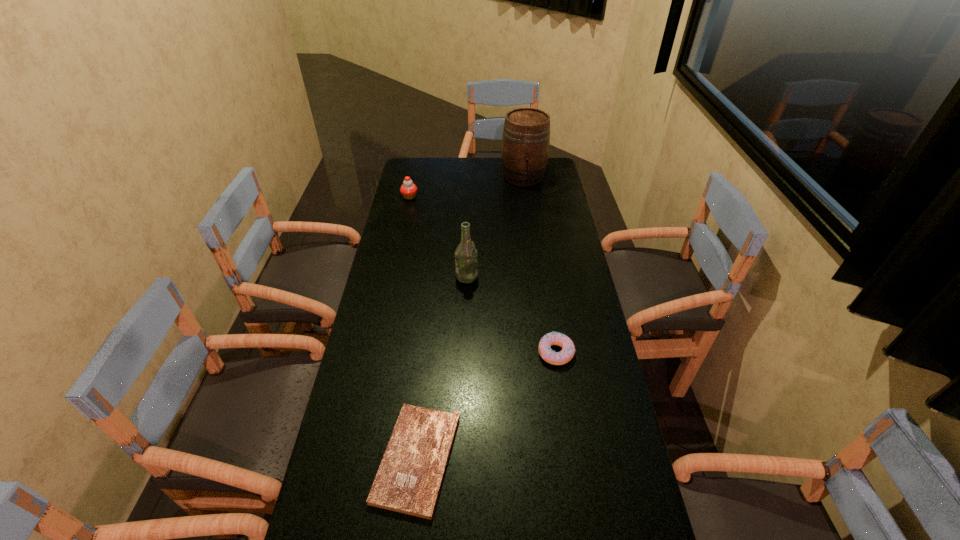
Image resolution: width=960 pixels, height=540 pixels. Identify the location of free space between the tallest object and the doughnut. (540, 265).

This screenshot has width=960, height=540. I want to click on free space between the leftmost object and the doughnut, so click(483, 275).

At what (x,y) coordinates should I click in order to perform the action: click on vacant area that lies between the farthest object and the nearest object. Please return your answer as a coordinate pair (x, y). Looking at the image, I should click on (x=470, y=318).

Locate an element on the screen. The image size is (960, 540). vacant area between the Bible and the third nearest object is located at coordinates (442, 368).

Locate an element on the screen. The width and height of the screenshot is (960, 540). vacant area that lies between the cider and the beer bottle is located at coordinates (495, 226).

Locate which object ranks in proximity to the shortest object. Please provide its 2D coordinates. Your answer should be formatted as a tuple, i.e. [(x, y)], where the tuple contains the x and y coordinates of a point satisfying the conditions above.

[(547, 354)]

Identify which object is the second nearest to the cupcake. Please provide its 2D coordinates. Your answer should be formatted as a tuple, i.e. [(x, y)], where the tuple contains the x and y coordinates of a point satisfying the conditions above.

[(466, 262)]

At what (x,y) coordinates should I click in order to perform the action: click on vacant position in the image that satisfies the following two spatial constraints: 1. on the side of the doughnut near the bung hole; 2. on the right side of the tallest object. Please return your answer as a coordinate pair (x, y). The width and height of the screenshot is (960, 540). Looking at the image, I should click on (548, 353).

At what (x,y) coordinates should I click in order to perform the action: click on free spot that satisfies the following two spatial constraints: 1. on the side of the farthest object near the bung hole; 2. on the surface of the third farthest object. Please return your answer as a coordinate pair (x, y). The image size is (960, 540). Looking at the image, I should click on (538, 276).

Where is `vacant space that satisfies the following two spatial constraints: 1. on the side of the fourth tallest object near the bung hole; 2. on the right side of the farthest object`? vacant space that satisfies the following two spatial constraints: 1. on the side of the fourth tallest object near the bung hole; 2. on the right side of the farthest object is located at coordinates (548, 353).